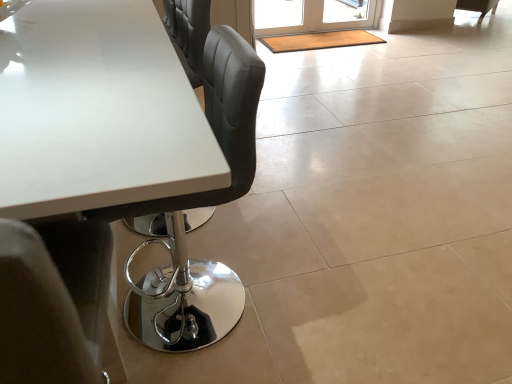
The image size is (512, 384). Identify the location of white glossy table at upper left. (97, 111).

Measure the distance between point (303, 11) and camera.

Point (303, 11) is 14.99 feet away from camera.

This screenshot has height=384, width=512. I want to click on white glossy table at upper left, so click(x=97, y=111).

Is translucent glass screen door at upper center wider than white glossy table at upper left?

In fact, translucent glass screen door at upper center might be narrower than white glossy table at upper left.

Considering the sizes of objects translucent glass screen door at upper center and white glossy table at upper left in the image provided, who is smaller, translucent glass screen door at upper center or white glossy table at upper left?

translucent glass screen door at upper center is smaller.

Is translucent glass screen door at upper center inside the boundaries of white glossy table at upper left, or outside?

translucent glass screen door at upper center is not enclosed by white glossy table at upper left.

Which object is positioned more to the left, translucent glass screen door at upper center or white glossy table at upper left?

white glossy table at upper left.

In the scene shown: Is translucent glass screen door at upper center at the back of matte black chair at upper right?

That's not correct — matte black chair at upper right is not looking away from translucent glass screen door at upper center.

Is the position of matte black chair at upper right more distant than that of translucent glass screen door at upper center?

Yes, the depth of matte black chair at upper right is greater than that of translucent glass screen door at upper center.

At what (x,y) coordinates should I click in order to perform the action: click on screen door to the left of matte black chair at upper right. Please return your answer as a coordinate pair (x, y). The width and height of the screenshot is (512, 384). Looking at the image, I should click on (324, 20).

From a real-world perspective, is matte black chair at upper right located beneath translucent glass screen door at upper center?

Indeed, from a real-world perspective, matte black chair at upper right is positioned beneath translucent glass screen door at upper center.

Looking at this image, can you confirm if matte black chair at upper right is taller than white glossy table at upper left?

In fact, matte black chair at upper right may be shorter than white glossy table at upper left.

Considering the positions of objects matte black chair at upper right and white glossy table at upper left in the image provided, who is more to the left, matte black chair at upper right or white glossy table at upper left?

Positioned to the left is white glossy table at upper left.

From a real-world perspective, which is physically below, matte black chair at upper right or white glossy table at upper left?

In real-world perspective, matte black chair at upper right is lower.

Can you tell me how much matte black chair at upper right and white glossy table at upper left differ in facing direction?

143 degrees.

Considering the positions of objects translucent glass screen door at upper center and matte black chair at upper right in the image provided, who is behind, translucent glass screen door at upper center or matte black chair at upper right?

matte black chair at upper right is further from the camera.

How many degrees apart are the facing directions of translucent glass screen door at upper center and matte black chair at upper right?

126 degrees separate the facing orientations of translucent glass screen door at upper center and matte black chair at upper right.

Which object is thinner, translucent glass screen door at upper center or matte black chair at upper right?

With smaller width is translucent glass screen door at upper center.

From the image's perspective, which is below, translucent glass screen door at upper center or matte black chair at upper right?

From the image's view, translucent glass screen door at upper center is below.

Is white glossy table at upper left aimed at translucent glass screen door at upper center?

No, white glossy table at upper left is not oriented towards translucent glass screen door at upper center.

Which point is more forward, (109,43) or (284,27)?

The point (109,43) is more forward.

Does white glossy table at upper left lie behind translucent glass screen door at upper center?

No, white glossy table at upper left is in front of translucent glass screen door at upper center.

Is white glossy table at upper left positioned beyond the bounds of matte black chair at upper right?

Absolutely, white glossy table at upper left is external to matte black chair at upper right.

Which of these two, white glossy table at upper left or matte black chair at upper right, is wider?

white glossy table at upper left.

Considering the sizes of objects white glossy table at upper left and matte black chair at upper right in the image provided, who is smaller, white glossy table at upper left or matte black chair at upper right?

matte black chair at upper right is smaller.

The image size is (512, 384). Find the location of `table in front of the translucent glass screen door at upper center`. table in front of the translucent glass screen door at upper center is located at coordinates (97, 111).

I want to click on chair above the translucent glass screen door at upper center (from the image's perspective), so click(x=478, y=6).

Estimate the real-world distances between objects in this image. Which object is further from translucent glass screen door at upper center, white glossy table at upper left or matte black chair at upper right?

Based on the image, white glossy table at upper left appears to be further to translucent glass screen door at upper center.

Consider the image. Looking at the image, which one is located closer to white glossy table at upper left, translucent glass screen door at upper center or matte black chair at upper right?

translucent glass screen door at upper center lies closer to white glossy table at upper left than the other object.

Estimate the real-world distances between objects in this image. Which object is closer to matte black chair at upper right, white glossy table at upper left or translucent glass screen door at upper center?

translucent glass screen door at upper center.

From the image, which object appears to be nearer to white glossy table at upper left, matte black chair at upper right or translucent glass screen door at upper center?

translucent glass screen door at upper center is closer to white glossy table at upper left.

From the image, which object appears to be farther from translucent glass screen door at upper center, matte black chair at upper right or white glossy table at upper left?

white glossy table at upper left is further to translucent glass screen door at upper center.

Based on their spatial positions, is translucent glass screen door at upper center or white glossy table at upper left closer to matte black chair at upper right?

translucent glass screen door at upper center lies closer to matte black chair at upper right than the other object.

Identify the location of screen door between white glossy table at upper left and matte black chair at upper right from front to back. pos(324,20).